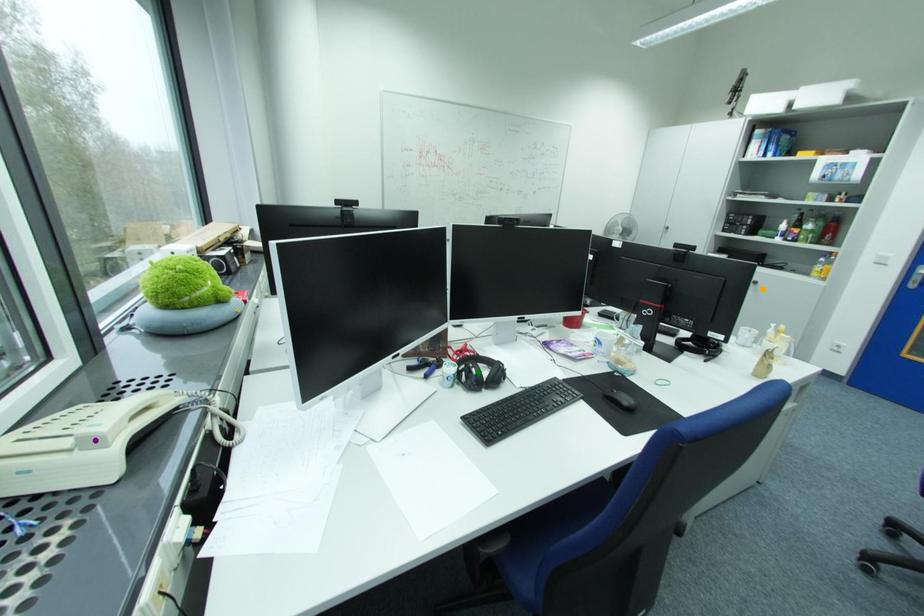
Order these from farthest to nearest:
1. purple point
2. green point
3. orange point

orange point, green point, purple point